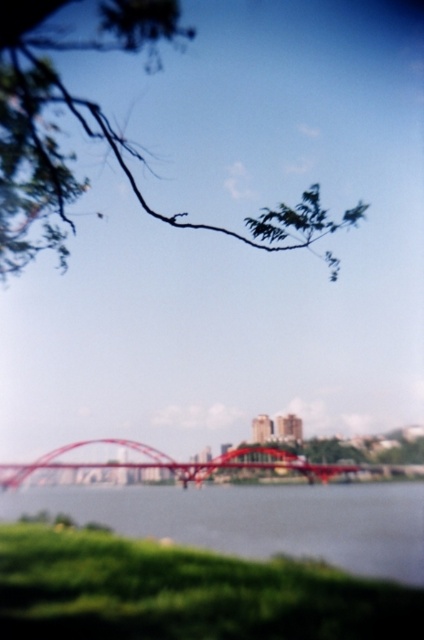
Can you confirm if green leafy branch at upper left is shorter than metallic red bridge at center?

In fact, green leafy branch at upper left may be taller than metallic red bridge at center.

Which is more to the left, green leafy branch at upper left or metallic red bridge at center?

From the viewer's perspective, metallic red bridge at center appears more on the left side.

In the scene shown: Measure the distance between green leafy branch at upper left and camera.

A distance of 46.90 feet exists between green leafy branch at upper left and camera.

What are the coordinates of `green leafy branch at upper left` in the screenshot? It's located at (97, 134).

Is point (53, 212) farther from viewer compared to point (396, 572)?

No, it is in front of (396, 572).

Locate an element on the screen. green leafy branch at upper left is located at coordinates (97, 134).

Does green grass at lower center lie in front of metallic red bridge at center?

That is True.

Identify the location of green grass at lower center. (259, 518).

This screenshot has width=424, height=640. Identify the location of green grass at lower center. (259, 518).